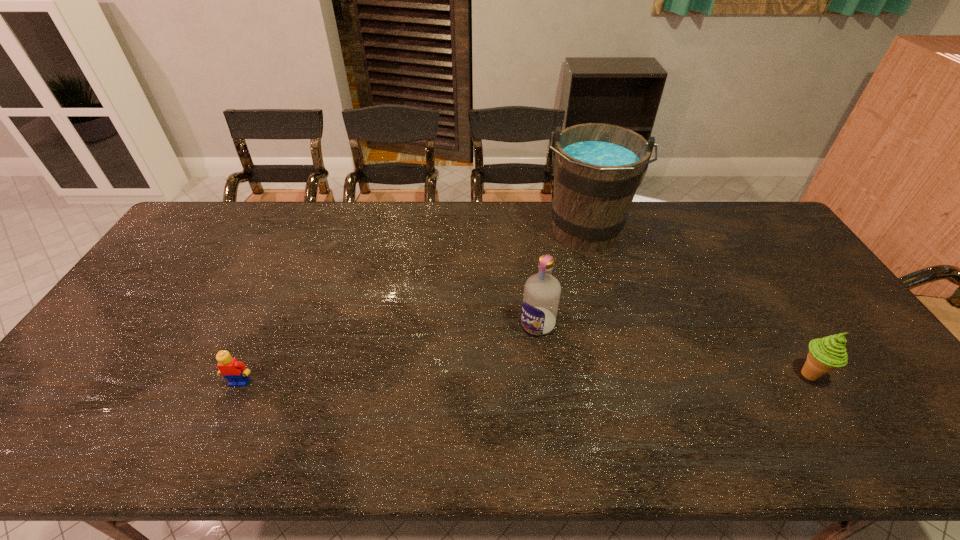
The image size is (960, 540). What are the coordinates of `free area in between the wine bucket and the icecream` in the screenshot? It's located at (696, 305).

Find the location of a particular element. empty location between the second tallest object and the shortest object is located at coordinates (389, 353).

Locate an element on the screen. empty location between the wine bucket and the third shortest object is located at coordinates (561, 279).

I want to click on free space between the third nearest object and the shortest object, so click(389, 353).

Locate an element on the screen. Image resolution: width=960 pixels, height=540 pixels. free space between the second farthest object and the Lego is located at coordinates (389, 353).

Locate an element on the screen. This screenshot has height=540, width=960. object that is the second closest to the wine bucket is located at coordinates (825, 354).

You are a GUI agent. You are given a task and a screenshot of the screen. Output one action in this format:
    pyautogui.click(x=<x>, y=<y>)
    Task: Click on the object that is the second nearest to the tallest object
    Image resolution: width=960 pixels, height=540 pixels.
    Given the screenshot: What is the action you would take?
    pyautogui.click(x=825, y=354)

Find the location of `free spot that satisfies the following two spatial constraints: 1. on the front side of the farthest object; 2. on the left side of the second shortest object`. free spot that satisfies the following two spatial constraints: 1. on the front side of the farthest object; 2. on the left side of the second shortest object is located at coordinates (621, 375).